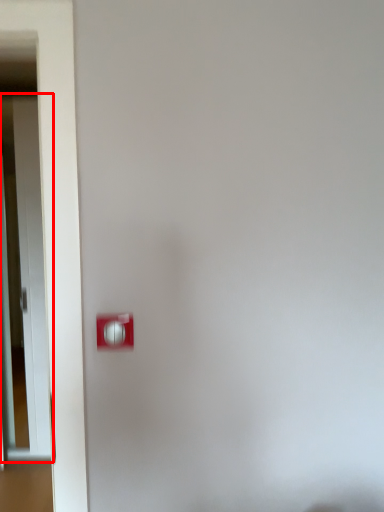
Question: From the image's perspective, what is the correct spatial relationship of door (annotated by the red box) in relation to light switch?

Choices:
 (A) above
 (B) below

Answer: (A)